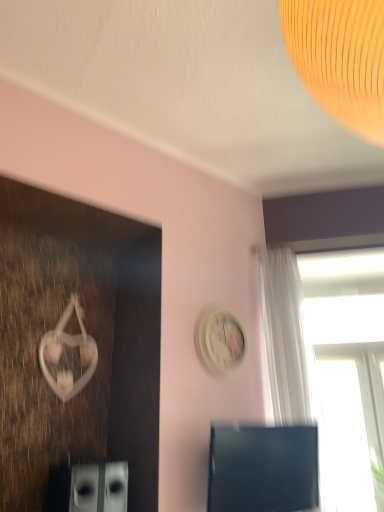
The height and width of the screenshot is (512, 384). I want to click on black glossy computer monitor at lower right, so click(263, 469).

This screenshot has height=512, width=384. I want to click on transparent glass window at upper right, so click(x=349, y=368).

This screenshot has height=512, width=384. I want to click on white glossy clock at upper center, so click(x=219, y=341).

In order to click on black glossy computer monitor at lower right in this screenshot , I will do `click(263, 469)`.

Is black glossy computer monitor at lower right thinner than white glossy clock at upper center?

Incorrect, the width of black glossy computer monitor at lower right is not less than that of white glossy clock at upper center.

Does black glossy computer monitor at lower right appear on the left side of white glossy clock at upper center?

No.

Considering the relative positions of black glossy computer monitor at lower right and white glossy clock at upper center in the image provided, is black glossy computer monitor at lower right behind white glossy clock at upper center?

No, it is in front of white glossy clock at upper center.

Is transparent glass window at upper right taller than white glossy clock at upper center?

Correct, transparent glass window at upper right is much taller as white glossy clock at upper center.

From a real-world perspective, is transparent glass window at upper right over white glossy clock at upper center?

No, from a real-world perspective, transparent glass window at upper right is not above white glossy clock at upper center.

How different are the orientations of transparent glass window at upper right and white glossy clock at upper center in degrees?

The angular difference between transparent glass window at upper right and white glossy clock at upper center is 51.4 degrees.

Is point (210, 331) behind point (380, 376)?

No, (210, 331) is closer to viewer.

Considering the sizes of objects white glossy clock at upper center and transparent glass window at upper right in the image provided, who is smaller, white glossy clock at upper center or transparent glass window at upper right?

white glossy clock at upper center.

How different are the orientations of white glossy clock at upper center and transparent glass window at upper right in degrees?

The angle between the facing direction of white glossy clock at upper center and the facing direction of transparent glass window at upper right is 51.4 degrees.

Considering the relative positions of white glossy clock at upper center and transparent glass window at upper right in the image provided, is white glossy clock at upper center to the right of transparent glass window at upper right from the viewer's perspective?

In fact, white glossy clock at upper center is to the left of transparent glass window at upper right.

Is transparent glass window at upper right at the back of black glossy computer monitor at lower right?

No, transparent glass window at upper right is not at the back of black glossy computer monitor at lower right.

Would you say black glossy computer monitor at lower right is outside transparent glass window at upper right?

Indeed, black glossy computer monitor at lower right is completely outside transparent glass window at upper right.

Considering the points (379, 368) and (266, 474), which point is behind, point (379, 368) or point (266, 474)?

The point (379, 368) is more distant.

From the image's perspective, is transparent glass window at upper right located above or below black glossy computer monitor at lower right?

transparent glass window at upper right is situated higher than black glossy computer monitor at lower right in the image.

Considering the sizes of transparent glass window at upper right and black glossy computer monitor at lower right in the image, is transparent glass window at upper right bigger or smaller than black glossy computer monitor at lower right?

Considering their sizes, transparent glass window at upper right takes up more space than black glossy computer monitor at lower right.

Visually, is transparent glass window at upper right positioned to the left or to the right of black glossy computer monitor at lower right?

transparent glass window at upper right is to the right of black glossy computer monitor at lower right.

Choose the correct answer: Is white glossy clock at upper center inside black glossy computer monitor at lower right or outside it?

white glossy clock at upper center exists outside the volume of black glossy computer monitor at lower right.

Can you confirm if white glossy clock at upper center is smaller than black glossy computer monitor at lower right?

Indeed, white glossy clock at upper center has a smaller size compared to black glossy computer monitor at lower right.

Is the surface of white glossy clock at upper center in direct contact with black glossy computer monitor at lower right?

No, white glossy clock at upper center is not touching black glossy computer monitor at lower right.

Find the location of a particular element. This screenshot has width=384, height=512. computer monitor in front of the white glossy clock at upper center is located at coordinates (263, 469).

The width and height of the screenshot is (384, 512). I want to click on clock above the transparent glass window at upper right (from a real-world perspective), so click(219, 341).

When comparing their distances from transparent glass window at upper right, does black glossy computer monitor at lower right or white glossy clock at upper center seem closer?

Among the two, black glossy computer monitor at lower right is located nearer to transparent glass window at upper right.

Looking at the image, which one is located closer to white glossy clock at upper center, transparent glass window at upper right or black glossy computer monitor at lower right?

black glossy computer monitor at lower right is closer to white glossy clock at upper center.

Estimate the real-world distances between objects in this image. Which object is further from black glossy computer monitor at lower right, transparent glass window at upper right or white glossy clock at upper center?

Based on the image, transparent glass window at upper right appears to be further to black glossy computer monitor at lower right.

From the image, which object appears to be nearer to black glossy computer monitor at lower right, white glossy clock at upper center or transparent glass window at upper right?

white glossy clock at upper center is closer to black glossy computer monitor at lower right.

Looking at the image, which one is located closer to white glossy clock at upper center, black glossy computer monitor at lower right or transparent glass window at upper right?

black glossy computer monitor at lower right.

Which object lies nearer to the anchor point transparent glass window at upper right, white glossy clock at upper center or black glossy computer monitor at lower right?

black glossy computer monitor at lower right is positioned closer to the anchor transparent glass window at upper right.

The height and width of the screenshot is (512, 384). Find the location of `computer monitor situated between white glossy clock at upper center and transparent glass window at upper right from left to right`. computer monitor situated between white glossy clock at upper center and transparent glass window at upper right from left to right is located at coordinates (263, 469).